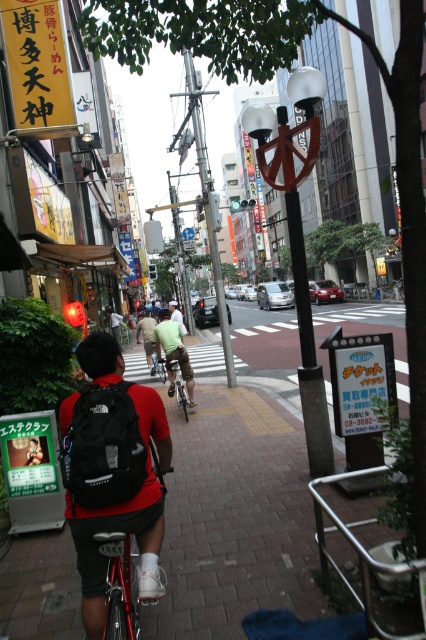
You are a delivery person who needs to locate the matte black backpack at center in an urban scene. According to the coordinates provided, where would you find it?

The matte black backpack at center is located at the 2D coordinates point (112, 472).

You are a photographer standing on the sidewalk and want to take a photo of the light brown fabric shirt at center and the silver metallic bicycle at center. Which object should you focus on first if you want to capture both in the frame without moving the camera?

The light brown fabric shirt at center is positioned on the left side of the silver metallic bicycle at center, so you should focus on the light brown fabric shirt at center first to ensure both are in the frame.